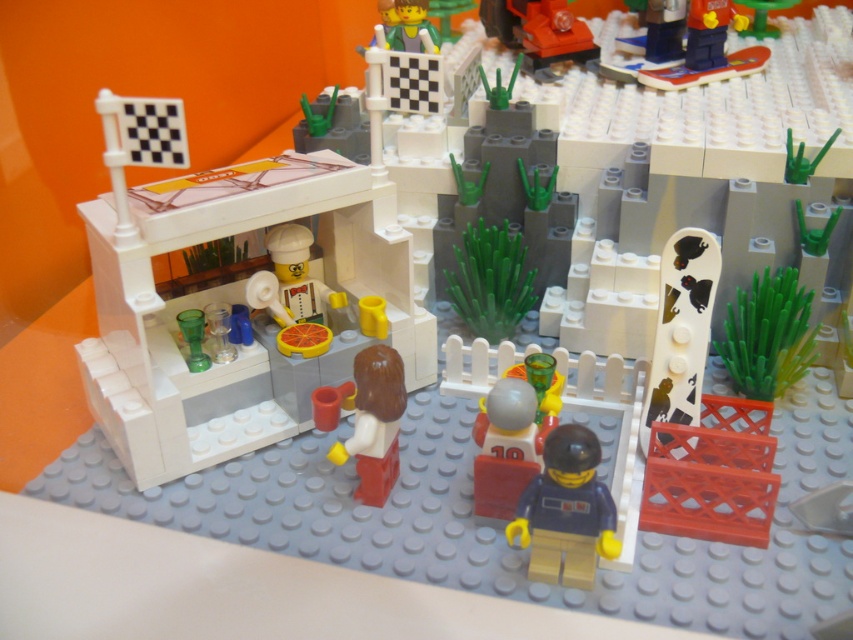
Question: Based on their relative distances, which object is nearer to the shiny orange car at upper center?

Choices:
 (A) smooth plastic snowboard at upper right
 (B) white matte figure at center
 (C) white glossy snowboard at right

Answer: (A)

Question: Can you confirm if shiny orange car at upper center is positioned above translucent yellow cup at center?

Choices:
 (A) yes
 (B) no

Answer: (A)

Question: Which object is closer to the camera taking this photo?

Choices:
 (A) translucent yellow cup at center
 (B) white glossy snowboard at right

Answer: (A)

Question: Can you confirm if dark blue plastic minifigure at lower right is smaller than smooth plastic snowboard at upper right?

Choices:
 (A) no
 (B) yes

Answer: (B)

Question: Is smooth gray head at center above smooth plastic minifigure at center?

Choices:
 (A) yes
 (B) no

Answer: (B)

Question: Which object appears closest to the camera in this image?

Choices:
 (A) dark blue plastic minifigure at lower right
 (B) white plastic stand at center

Answer: (A)